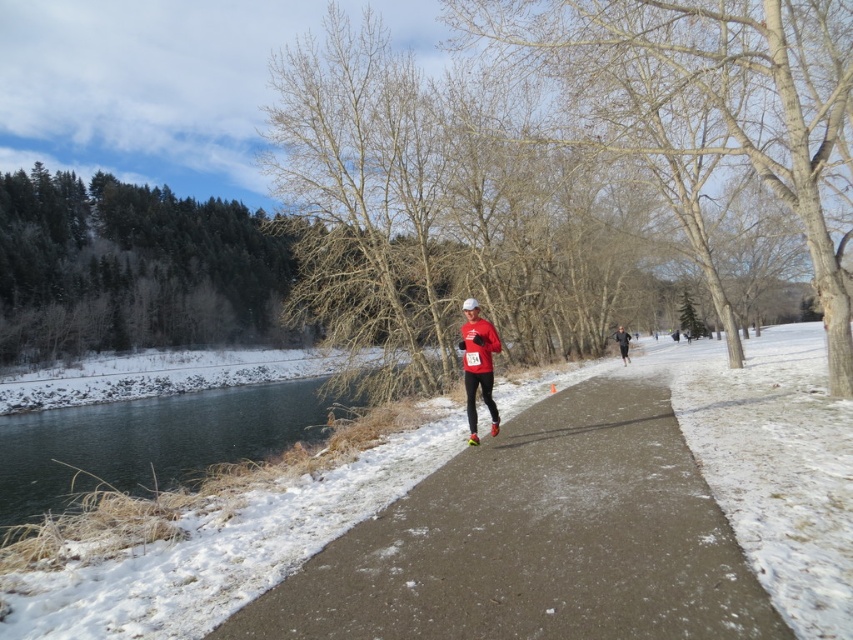
You are a photographer standing at the edge of the path. You want to take a photo of both the matte red running suit at center and the black running suit at center in the same frame. The minimum distance between the two suits required for your camera to focus on both is 20 meters. Can you capture both in one shot?

The matte red running suit at center and black running suit at center are 22.06 meters apart, which exceeds the 20 meters minimum distance required for the camera to focus on both. Therefore, yes, you can capture both in one shot.

You are a runner preparing to start a race. You see two points marked on the path ahead of you. The first point is at coordinates point (198, 413) and the second point is at point (621, 356). Which point should you reach first if you are running towards the camera?

You should reach point (621, 356) first because point (198, 413) is behind it.